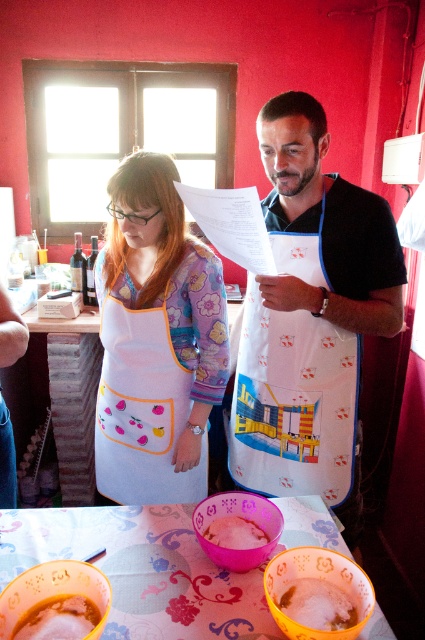
Is white fabric apron with colorful design at center positioned at the back of pink matte plastic bowl at center?

Yes.

Which is above, white fabric apron with colorful design at center or pink matte plastic bowl at center?

white fabric apron with colorful design at center is above.

What do you see at coordinates (292, 403) in the screenshot?
I see `white fabric apron with colorful design at center` at bounding box center [292, 403].

At what (x,y) coordinates should I click in order to perform the action: click on white fabric apron with colorful design at center. Please return your answer as a coordinate pair (x, y). The image size is (425, 640). Looking at the image, I should click on (292, 403).

Between white fabric apron with colorful design at center and white frothy liquid at lower left, which one has less height?

white frothy liquid at lower left

Based on the photo, does white fabric apron with colorful design at center have a lesser width compared to white frothy liquid at lower left?

In fact, white fabric apron with colorful design at center might be wider than white frothy liquid at lower left.

Image resolution: width=425 pixels, height=640 pixels. Find the location of `white fabric apron with colorful design at center`. white fabric apron with colorful design at center is located at coordinates (292, 403).

The width and height of the screenshot is (425, 640). In order to click on white fabric apron with colorful design at center in this screenshot , I will do `click(292, 403)`.

Between white apron with colorful designs at center and white frothy liquid at lower left, which one has less height?

With less height is white frothy liquid at lower left.

Can you confirm if white apron with colorful designs at center is shorter than white frothy liquid at lower left?

In fact, white apron with colorful designs at center may be taller than white frothy liquid at lower left.

Locate an element on the screen. The height and width of the screenshot is (640, 425). white apron with colorful designs at center is located at coordinates (155, 340).